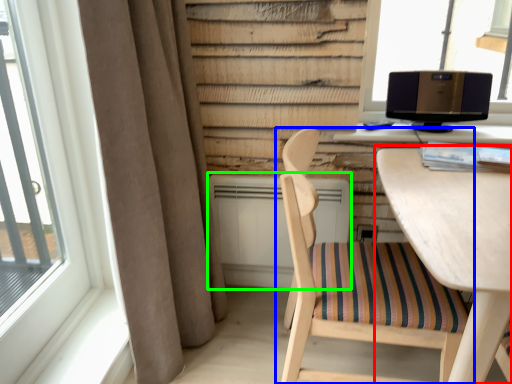
Question: Which object is the farthest from table (highlighted by a red box)? Choose among these: chair (highlighted by a blue box) or air conditioner (highlighted by a green box).

Choices:
 (A) chair
 (B) air conditioner

Answer: (B)